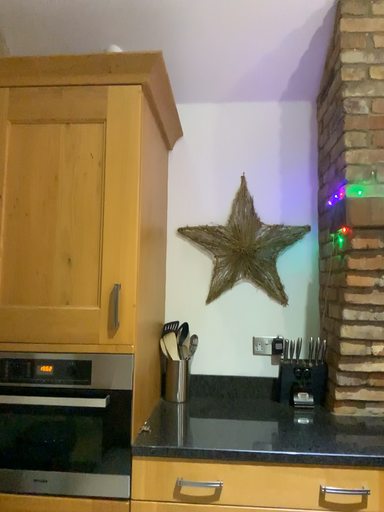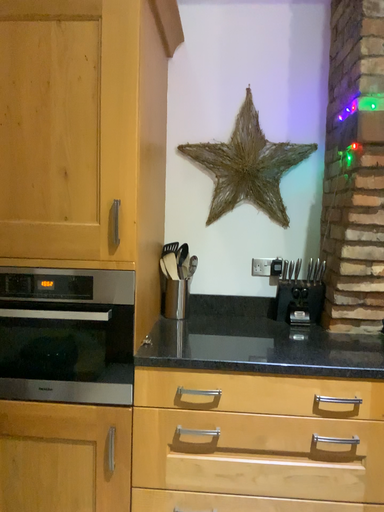
Question: Which way did the camera rotate in the video?

Choices:
 (A) rotated upward
 (B) rotated downward

Answer: (B)